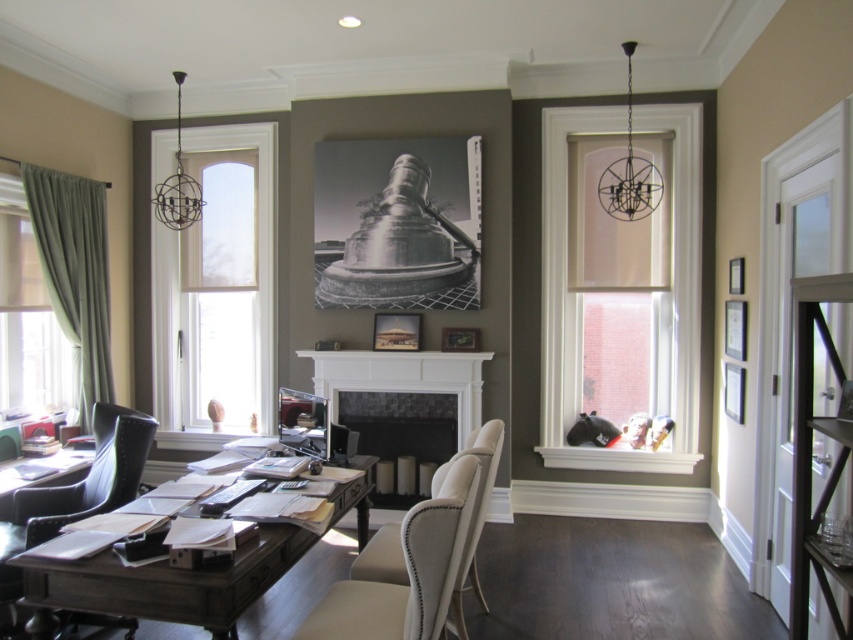
Question: Which point is closer to the camera taking this photo?

Choices:
 (A) (73, 179)
 (B) (477, 500)
 (C) (204, 136)

Answer: (B)

Question: Is black leather chair at lower left above beige fabric chair at center?

Choices:
 (A) yes
 (B) no

Answer: (A)

Question: Can you confirm if white fabric window at left is wider than beige fabric chair at center?

Choices:
 (A) no
 (B) yes

Answer: (B)

Question: Which point appears closest to the camera in this image?

Choices:
 (A) (15, 529)
 (B) (99, 371)
 (C) (74, 605)

Answer: (C)

Question: Which is farther from the white marble fireplace at center?

Choices:
 (A) dark wood desk at center
 (B) black leather chair at lower left
 (C) green velvet curtain at left
 (D) white matte window at upper right

Answer: (B)

Question: Is dark wood desk at center wider than beige fabric chair at center?

Choices:
 (A) no
 (B) yes

Answer: (B)